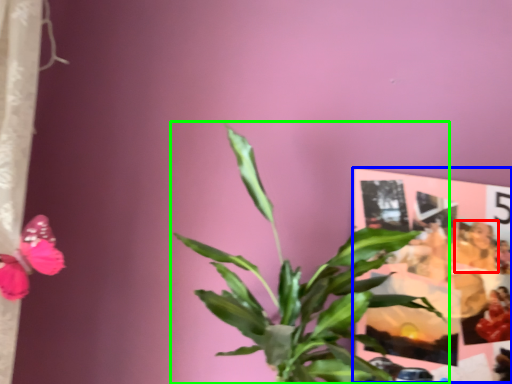
Question: Considering the real-world distances, which object is farthest from person (highlighted by a red box)? postcard (highlighted by a blue box) or houseplant (highlighted by a green box)?

Choices:
 (A) postcard
 (B) houseplant

Answer: (B)